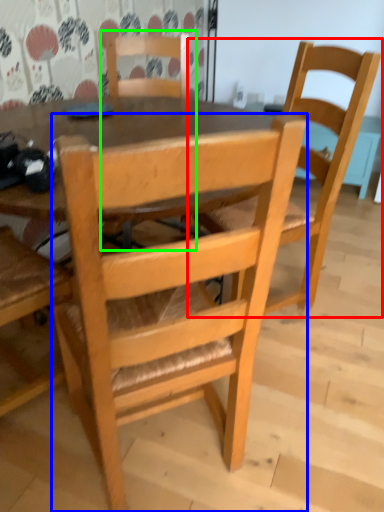
Question: Considering the real-world distances, which object is closest to chair (highlighted by a red box)? chair (highlighted by a blue box) or chair (highlighted by a green box).

Choices:
 (A) chair
 (B) chair

Answer: (A)